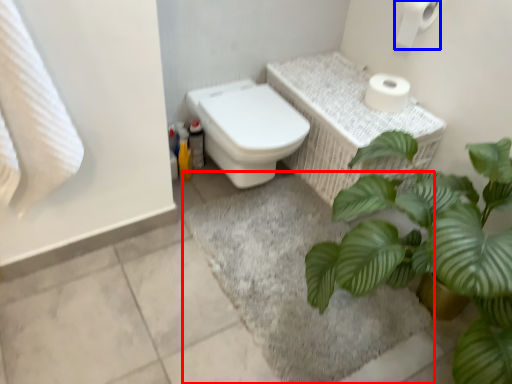
Question: Which object appears farthest to the camera in this image, bath mat (highlighted by a red box) or toilet paper (highlighted by a blue box)?

Choices:
 (A) bath mat
 (B) toilet paper

Answer: (B)